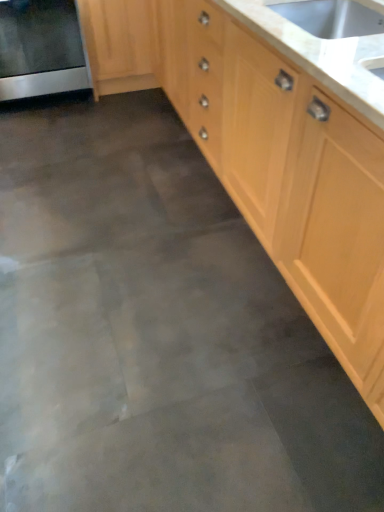
Question: Does light wood cabinet at center, the second cabinetry when ordered from left to right, appear on the right side of satin silver oven at left?

Choices:
 (A) no
 (B) yes

Answer: (B)

Question: Would you say light wood cabinet at center, positioned as the first cabinetry in right-to-left order, contains satin silver oven at left?

Choices:
 (A) yes
 (B) no

Answer: (B)

Question: Is light wood cabinet at center, the second cabinetry when ordered from left to right, smaller than satin silver oven at left?

Choices:
 (A) yes
 (B) no

Answer: (B)

Question: Is light wood cabinet at center, the second cabinetry when ordered from left to right, bigger than satin silver oven at left?

Choices:
 (A) yes
 (B) no

Answer: (A)

Question: Is light wood cabinet at center, positioned as the first cabinetry in right-to-left order, to the left of satin silver oven at left from the viewer's perspective?

Choices:
 (A) no
 (B) yes

Answer: (A)

Question: Considering the relative sizes of light wood cabinet at center, positioned as the first cabinetry in right-to-left order, and satin silver oven at left in the image provided, is light wood cabinet at center, positioned as the first cabinetry in right-to-left order, wider than satin silver oven at left?

Choices:
 (A) yes
 (B) no

Answer: (B)

Question: Could you tell me if light wood cabinet at center, positioned as the first cabinetry in right-to-left order, is turned towards light wood/texture cabinet at upper left, the 2th cabinetry from the right?

Choices:
 (A) yes
 (B) no

Answer: (A)

Question: Considering the relative positions of light wood cabinet at center, positioned as the first cabinetry in right-to-left order, and light wood/texture cabinet at upper left, the 2th cabinetry from the right, in the image provided, is light wood cabinet at center, positioned as the first cabinetry in right-to-left order, behind light wood/texture cabinet at upper left, the 2th cabinetry from the right,?

Choices:
 (A) yes
 (B) no

Answer: (B)

Question: Is light wood cabinet at center, the second cabinetry when ordered from left to right, wider than light wood/texture cabinet at upper left, the 1th cabinetry from the left?

Choices:
 (A) no
 (B) yes

Answer: (A)

Question: Is light wood/texture cabinet at upper left, the 2th cabinetry from the right, located within light wood cabinet at center, positioned as the first cabinetry in right-to-left order?

Choices:
 (A) no
 (B) yes

Answer: (A)

Question: Is light wood cabinet at center, positioned as the first cabinetry in right-to-left order, not near light wood/texture cabinet at upper left, the 1th cabinetry from the left?

Choices:
 (A) yes
 (B) no

Answer: (A)

Question: Can you confirm if light wood cabinet at center, positioned as the first cabinetry in right-to-left order, is positioned to the right of light wood/texture cabinet at upper left, the 1th cabinetry from the left?

Choices:
 (A) yes
 (B) no

Answer: (A)

Question: Is white marble countertop at upper right thinner than light wood cabinet at center, positioned as the first cabinetry in right-to-left order?

Choices:
 (A) yes
 (B) no

Answer: (A)